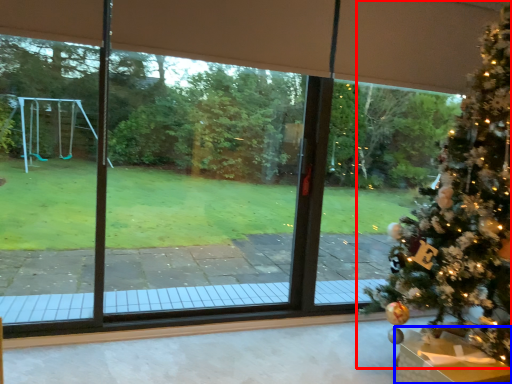
Question: Which object appears farthest to the camera in this image, christmas tree (highlighted by a red box) or furniture (highlighted by a blue box)?

Choices:
 (A) christmas tree
 (B) furniture

Answer: (B)